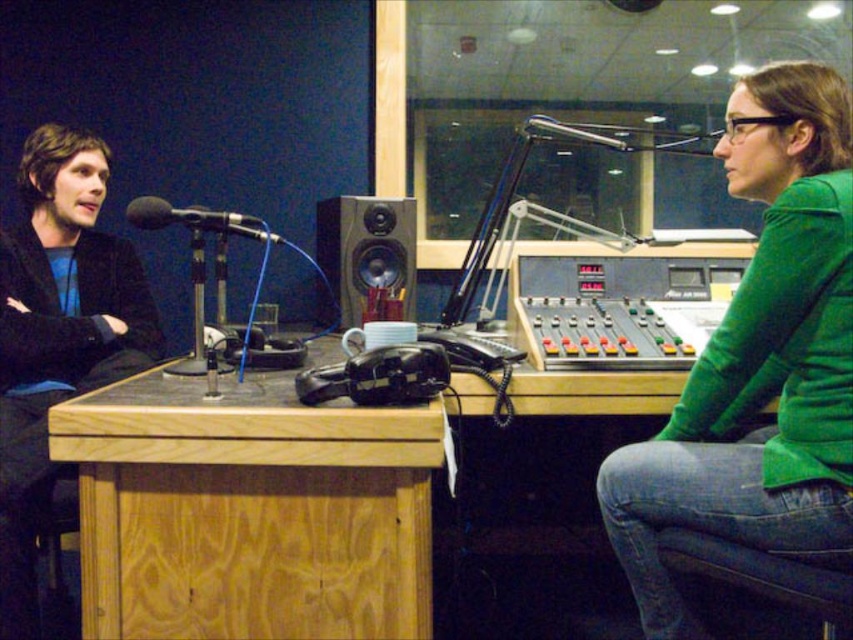
Based on the photo, does matte black jacket at left have a greater width compared to black matte microphone at left?

Indeed, matte black jacket at left has a greater width compared to black matte microphone at left.

Does matte black jacket at left have a greater height compared to black matte microphone at left?

Yes.

At what (x,y) coordinates should I click in order to perform the action: click on matte black jacket at left. Please return your answer as a coordinate pair (x, y). This screenshot has width=853, height=640. Looking at the image, I should click on (57, 339).

Locate an element on the screen. The height and width of the screenshot is (640, 853). matte black jacket at left is located at coordinates (57, 339).

Which is behind, point (805, 234) or point (204, 224)?

The point (204, 224) is more distant.

Is green matte shirt at upper right in front of black matte microphone at left?

Yes, green matte shirt at upper right is in front of black matte microphone at left.

This screenshot has height=640, width=853. Describe the element at coordinates (759, 360) in the screenshot. I see `green matte shirt at upper right` at that location.

Locate an element on the screen. green matte shirt at upper right is located at coordinates pyautogui.click(x=759, y=360).

Which is below, green matte shirt at upper right or matte black jacket at left?

matte black jacket at left is lower down.

Identify the location of green matte shirt at upper right. This screenshot has height=640, width=853. (759, 360).

This screenshot has width=853, height=640. Identify the location of green matte shirt at upper right. (759, 360).